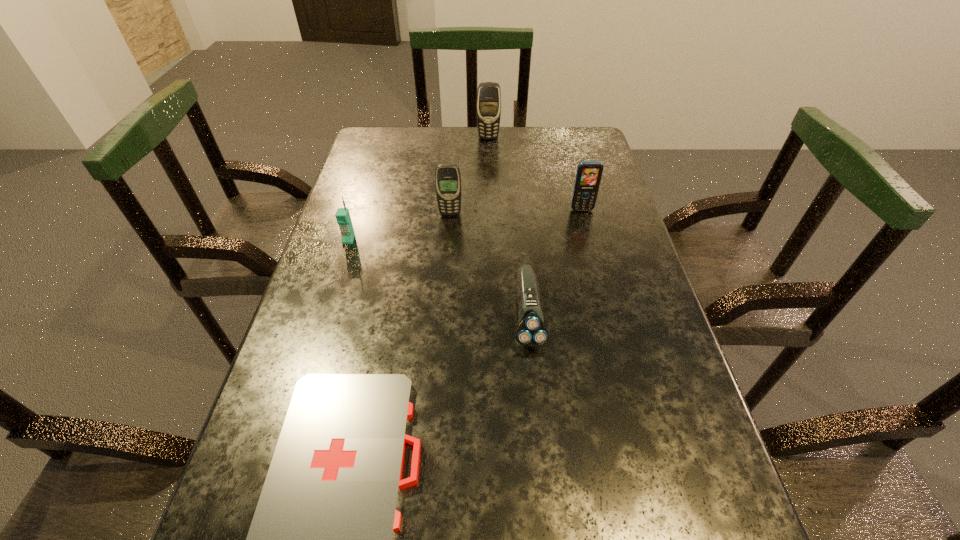
Where is `vacant position at the right edge of the desktop`? The width and height of the screenshot is (960, 540). vacant position at the right edge of the desktop is located at coordinates (636, 500).

This screenshot has width=960, height=540. I want to click on vacant area at the far left corner of the desktop, so click(398, 158).

Image resolution: width=960 pixels, height=540 pixels. Identify the location of vacant space at the far right corner of the desktop. (592, 152).

Identify the location of vacant area that lies between the farthest object and the second cellular telephone from left to right. The image size is (960, 540). (469, 176).

Locate an element on the screen. The image size is (960, 540). vacant area between the tallest object and the second nearest object is located at coordinates (508, 226).

The height and width of the screenshot is (540, 960). What are the coordinates of `empty location between the second nearest cellular telephone and the farthest object` in the screenshot? It's located at (469, 176).

What are the coordinates of `free area in between the farthest cellular telephone and the fourth nearest object` in the screenshot? It's located at (469, 176).

The image size is (960, 540). Identify the location of free point between the fifth object from left to right and the shortest cellular telephone. (438, 276).

This screenshot has height=540, width=960. I want to click on free space between the rightmost object and the third nearest object, so click(466, 225).

Identify the location of the closest object to the third cellular telephone from right to left. (343, 218).